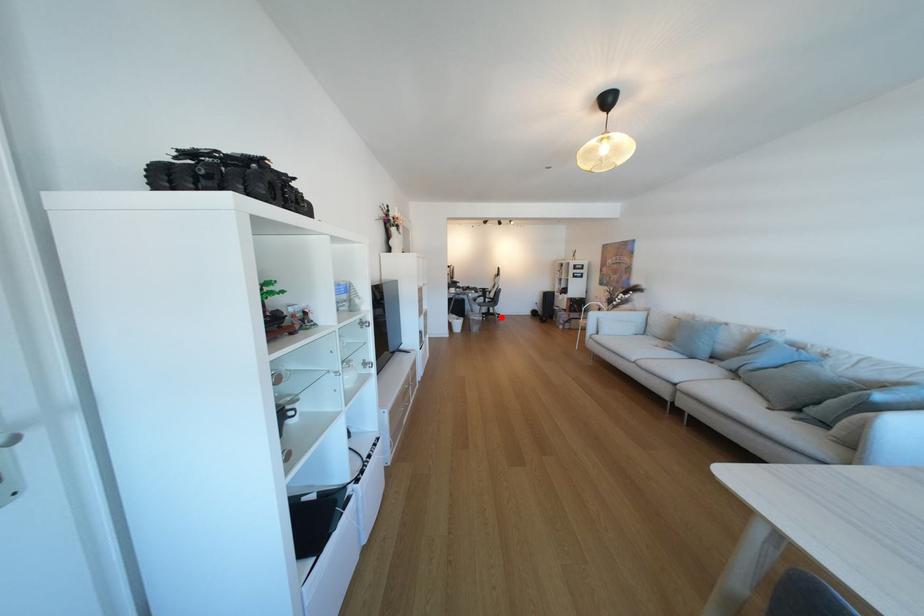
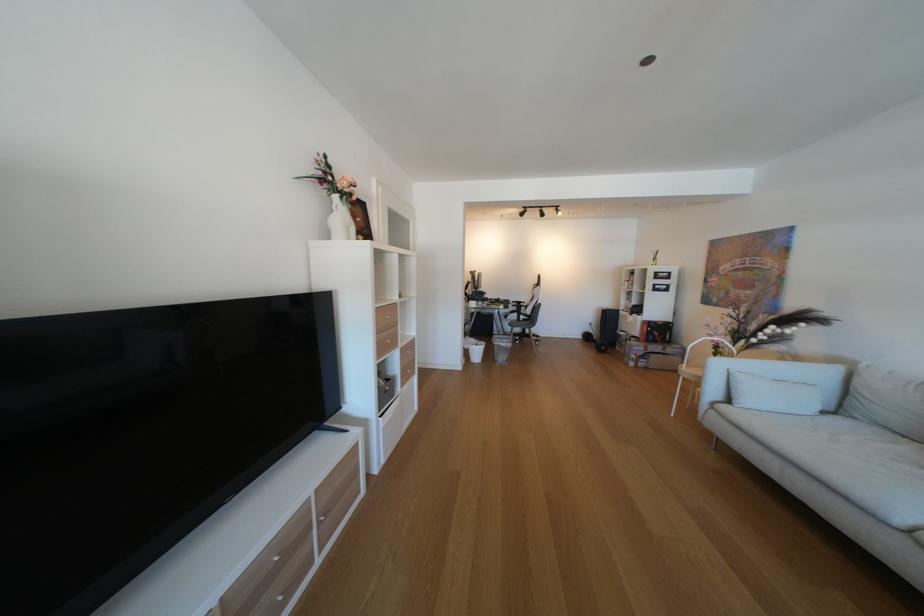
Where in the second image is the point corresponding to the highlighted location from the first image?

(537, 339)